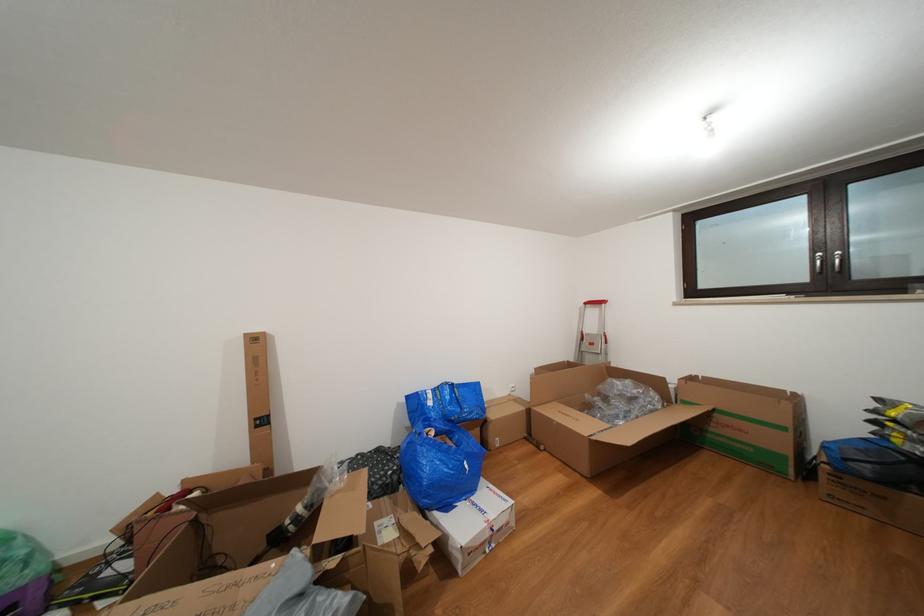
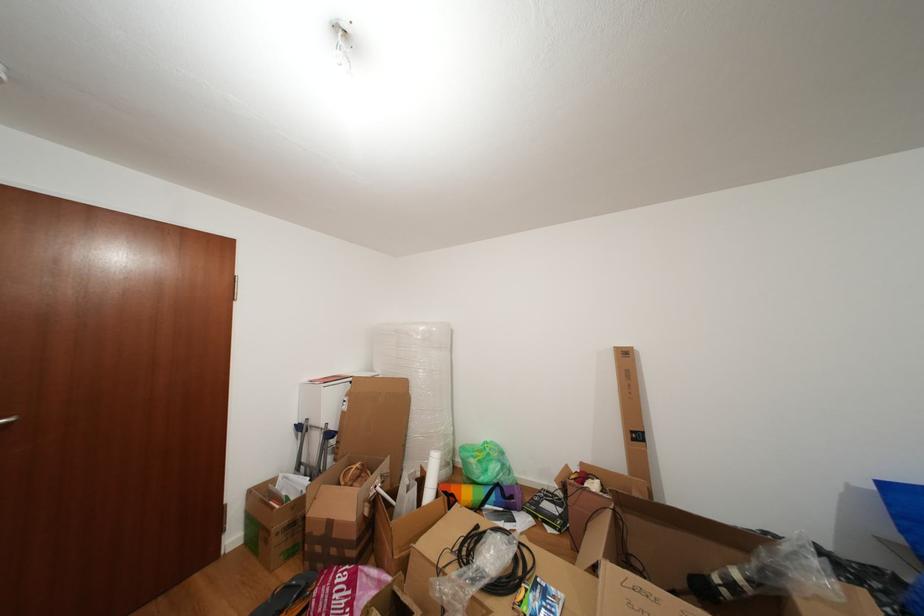
The point at (373, 475) is marked in the first image. Where is the corresponding point in the second image?

(871, 598)